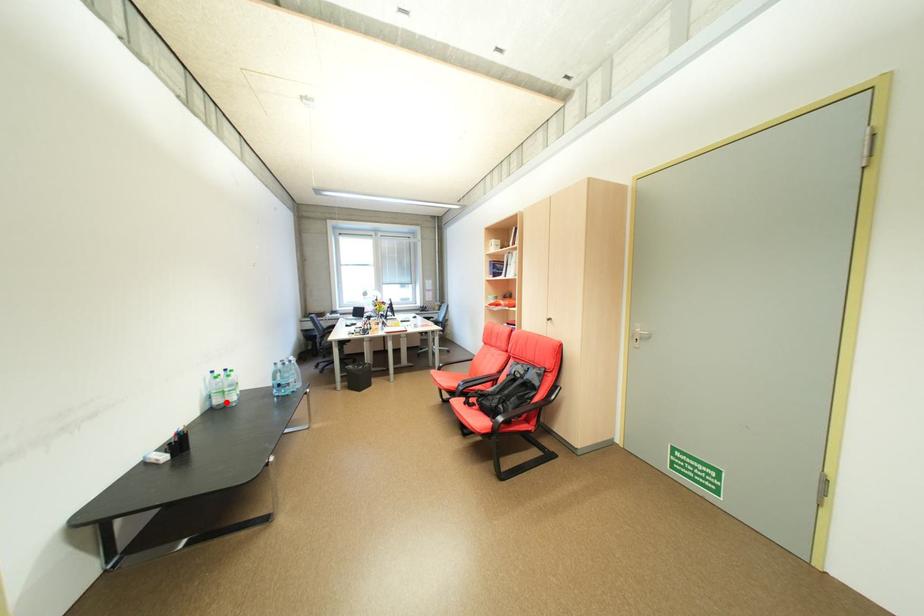
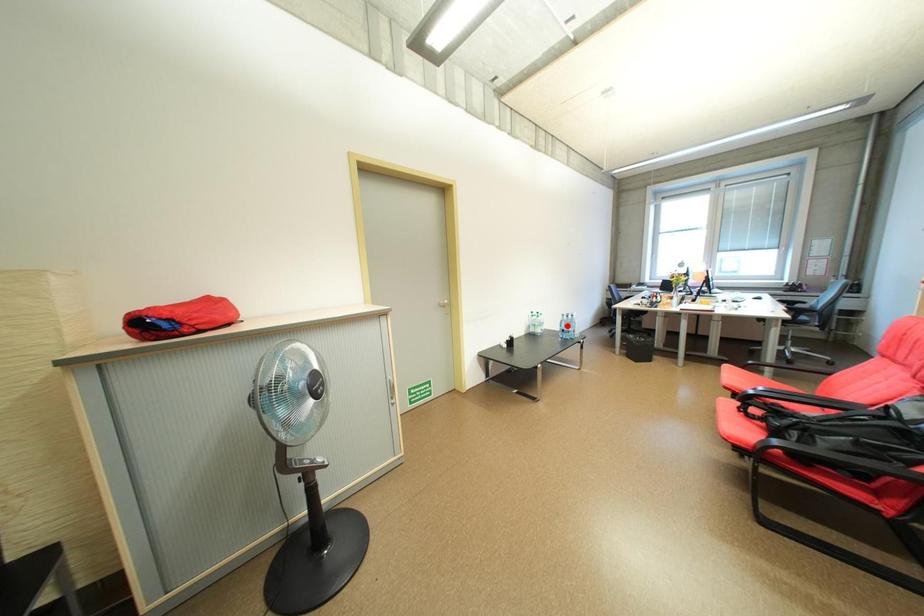
I am providing you with two images of the same scene from different viewpoints. A red point is marked on the first image and another point is marked on the second image. Is the red point in image1 aligned with the point shown in image2?

No